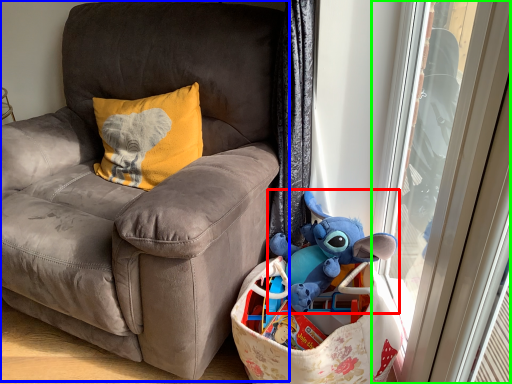
Question: Estimate the real-world distances between objects in this image. Which object is farther from toy (highlighted by a red box), chair (highlighted by a blue box) or screen door (highlighted by a green box)?

Choices:
 (A) chair
 (B) screen door

Answer: (A)